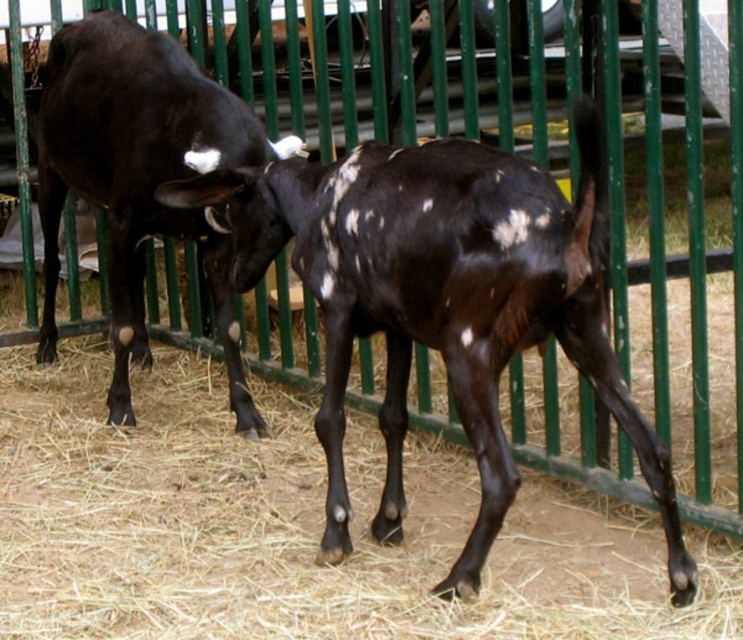
Question: Estimate the real-world distances between objects in this image. Which object is farther from the black glossy bull at left?

Choices:
 (A) brown straw at center
 (B) speckled glossy goat at center

Answer: (B)

Question: Is speckled glossy goat at center thinner than black glossy bull at left?

Choices:
 (A) yes
 (B) no

Answer: (B)

Question: Does brown straw at center lie in front of speckled glossy goat at center?

Choices:
 (A) no
 (B) yes

Answer: (A)

Question: Which is farther from the black glossy bull at left?

Choices:
 (A) brown straw at center
 (B) speckled glossy goat at center

Answer: (B)

Question: Which of these objects is positioned closest to the speckled glossy goat at center?

Choices:
 (A) brown straw at center
 (B) black glossy bull at left

Answer: (A)

Question: Can you confirm if brown straw at center is smaller than speckled glossy goat at center?

Choices:
 (A) no
 (B) yes

Answer: (A)